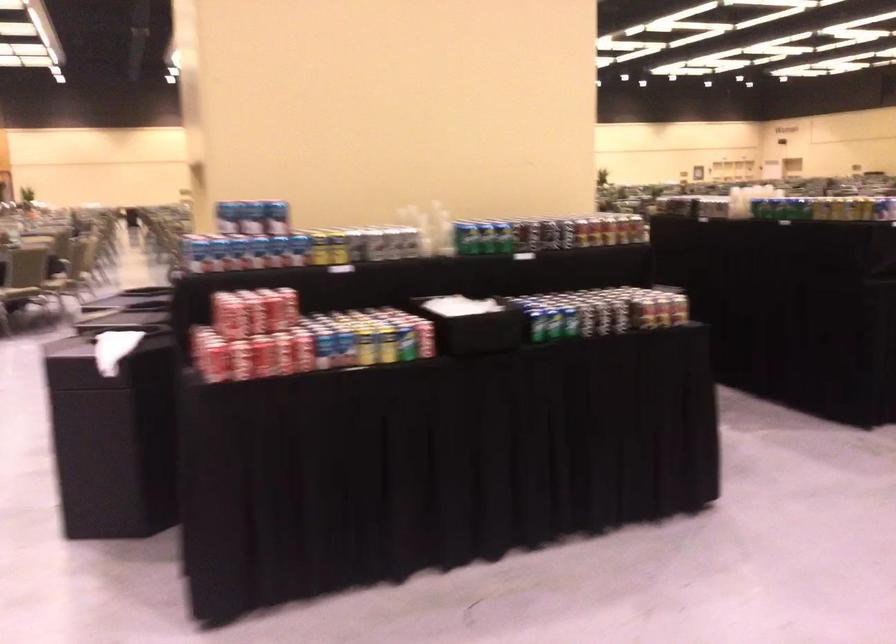
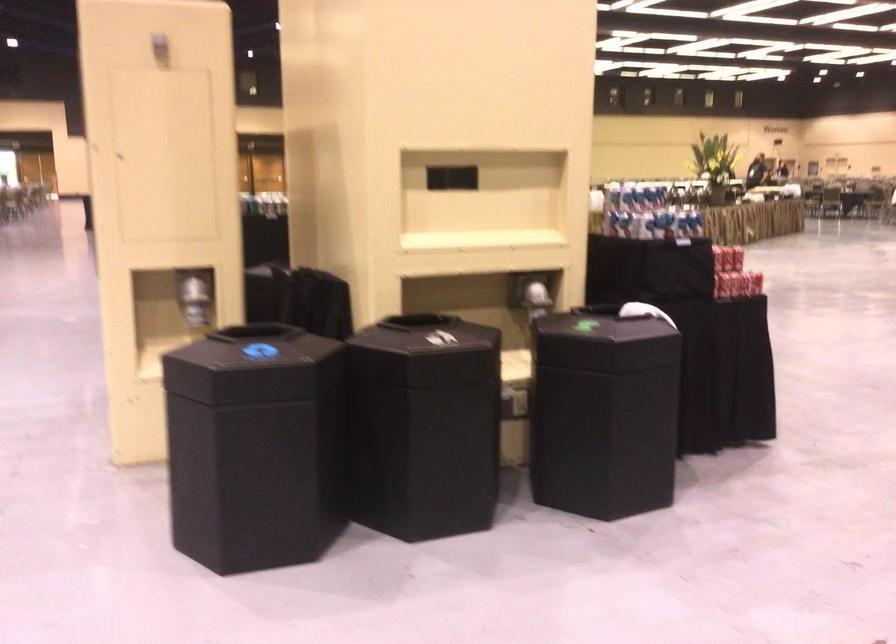
Question: I am providing you with two images of the same scene from different viewpoints. Which of the following objects are not visible in image2?

Choices:
 (A) pair of scissors
 (B) green soda can
 (C) black bin lid
 (D) shiny dispenser lever

Answer: (B)